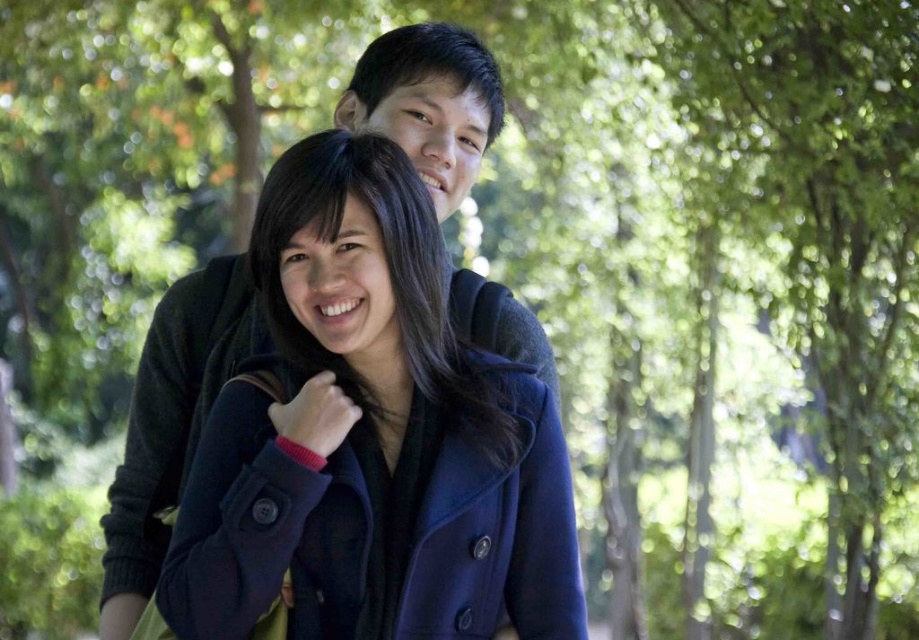
Consider the image. You are standing at the center of the park and see the navy wool coat at center and the green leafy tree at upper center. If you want to take a photo of both objects in the same frame, which one should you focus on first to ensure both are in focus?

The navy wool coat at center is closer to you than the green leafy tree at upper center, so focusing on the navy wool coat at center will ensure both are in focus.

You are standing in the park and see the navy wool coat at center and the green leafy tree at upper center. Which object is nearer to you?

The navy wool coat at center is closer to the viewer than the green leafy tree at upper center.